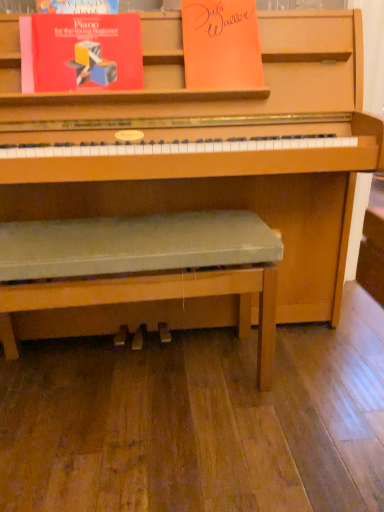
This screenshot has height=512, width=384. I want to click on free space above green fabric bench at center (from a real-world perspective), so click(x=180, y=220).